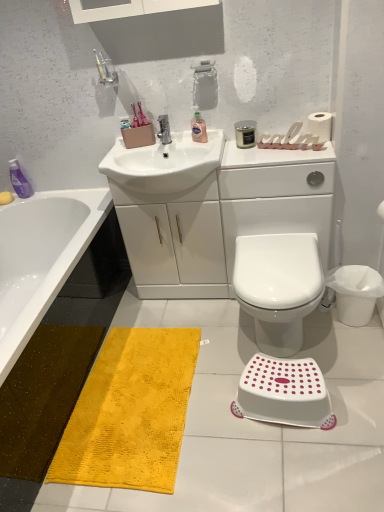
Where is `vacant space to the right of white plastic step stool at lower right`? The width and height of the screenshot is (384, 512). vacant space to the right of white plastic step stool at lower right is located at coordinates (359, 398).